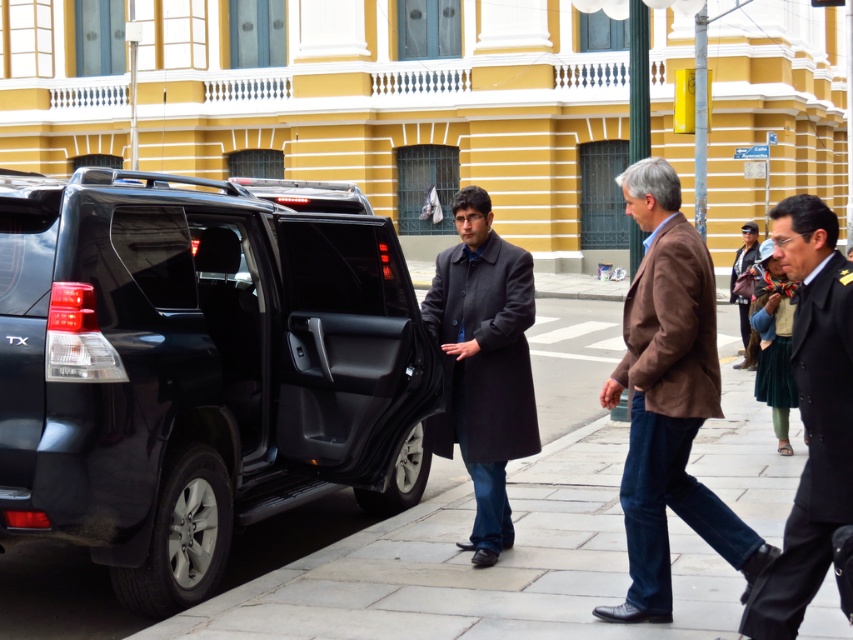
Between shiny black minivan at center and dark gray wool coat at center, which one is positioned lower?

dark gray wool coat at center is lower down.

Is point (323, 442) behind point (465, 448)?

Yes, point (323, 442) is behind point (465, 448).

Where is `shiny black minivan at center`? shiny black minivan at center is located at coordinates (199, 368).

Is shiny black minivan at center wider than brown woolen jacket at center?

Indeed, shiny black minivan at center has a greater width compared to brown woolen jacket at center.

Is point (392, 326) less distant than point (668, 403)?

No, it is behind (668, 403).

Locate an element on the screen. shiny black minivan at center is located at coordinates (199, 368).

Which of these two, shiny black minivan at center or dark brown leather jacket at center, stands taller?

With more height is shiny black minivan at center.

Looking at this image, between shiny black minivan at center and dark brown leather jacket at center, which one is positioned higher?

dark brown leather jacket at center is above.

Between point (4, 323) and point (746, 316), which one is positioned in front?

Point (4, 323)

At what (x,y) coordinates should I click in order to perform the action: click on shiny black minivan at center. Please return your answer as a coordinate pair (x, y). The width and height of the screenshot is (853, 640). Looking at the image, I should click on (199, 368).